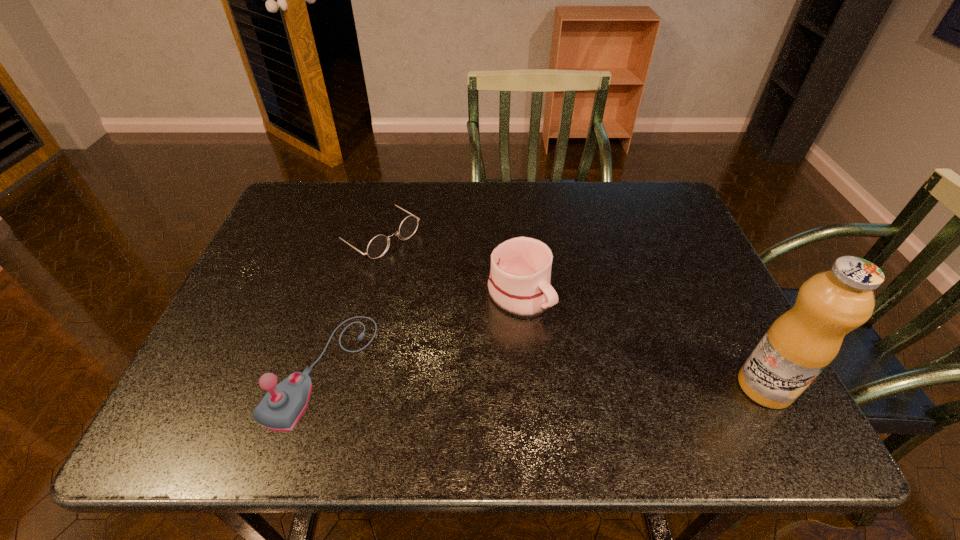
Locate an element on the screen. free space on the desktop that is between the joystick and the tallest object and is positioned on the side with the handle of the second object from right to left is located at coordinates (604, 380).

Identify the location of vacant spot on the desktop that is between the joystick and the rightmost object and is positioned on the front-facing side of the farthest object. The image size is (960, 540). (600, 380).